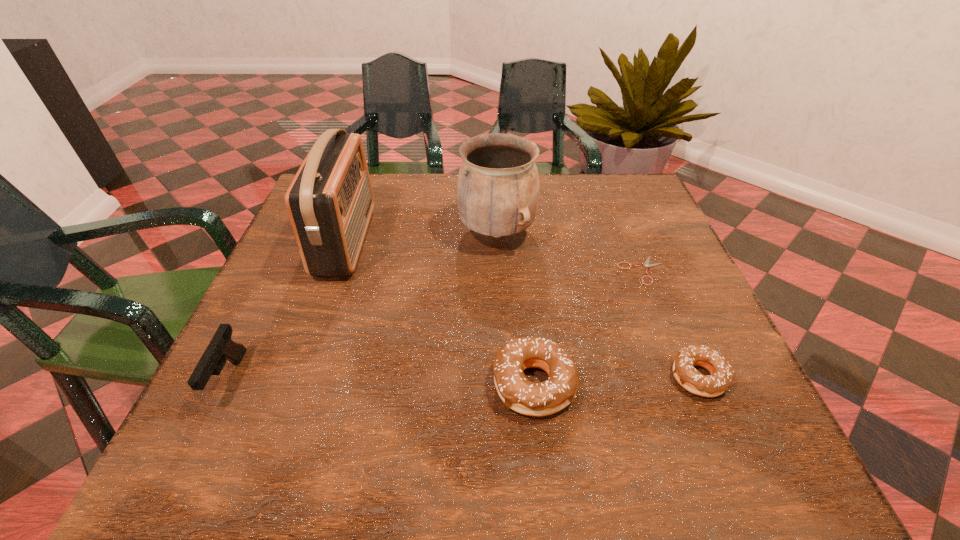
The image size is (960, 540). Identify the location of free space located on the back of the shorter doughnut. (636, 229).

The image size is (960, 540). Identify the location of vacant region located 0.250m on the left of the urn. (358, 233).

The image size is (960, 540). What are the coordinates of `vacant space located on the front-facing side of the radio receiver` in the screenshot? It's located at (392, 241).

Locate an element on the screen. The image size is (960, 540). vacant space located 0.220m on the front of the shortest object is located at coordinates (682, 370).

At what (x,y) coordinates should I click in order to perform the action: click on urn located at the far edge. Please return your answer as a coordinate pair (x, y). This screenshot has height=540, width=960. Looking at the image, I should click on [498, 188].

I want to click on radio receiver present at the far edge, so click(330, 201).

What are the coordinates of `pistol present at the near edge` in the screenshot? It's located at (221, 347).

The width and height of the screenshot is (960, 540). In order to click on radio receiver at the left edge in this screenshot , I will do `click(330, 201)`.

The width and height of the screenshot is (960, 540). Find the location of `pistol situated at the left edge`. pistol situated at the left edge is located at coordinates (221, 347).

Locate an element on the screen. This screenshot has height=540, width=960. doughnut located at the right edge is located at coordinates (721, 371).